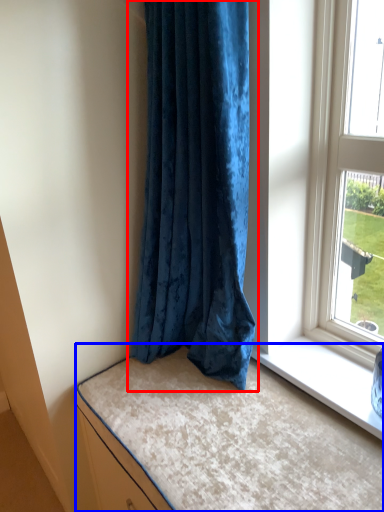
Question: Which object is further to the camera taking this photo, curtain (highlighted by a red box) or bed (highlighted by a blue box)?

Choices:
 (A) curtain
 (B) bed

Answer: (A)